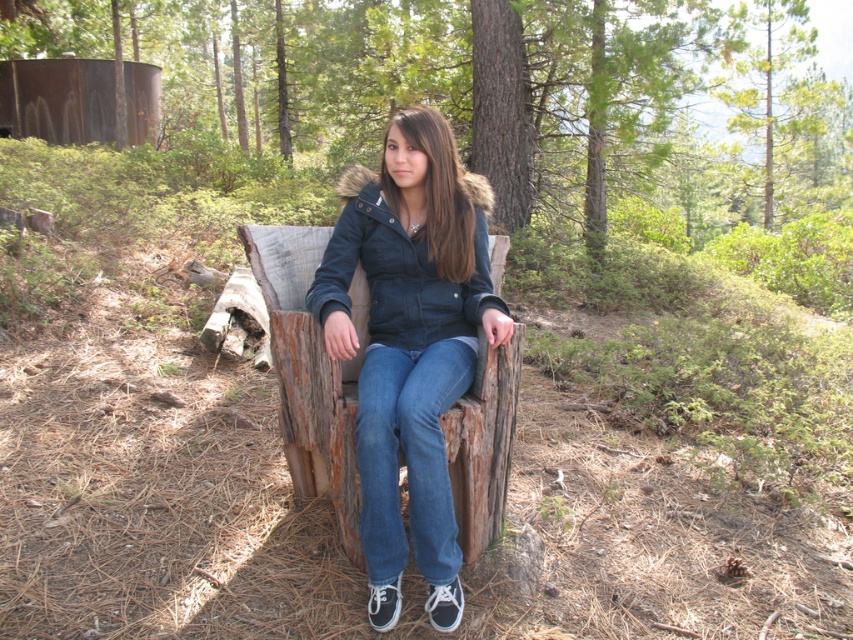
This screenshot has height=640, width=853. What do you see at coordinates (410, 346) in the screenshot? I see `denim jacket at center` at bounding box center [410, 346].

Between denim jacket at center and denim at center, which one has more height?

denim jacket at center is taller.

What do you see at coordinates (410, 346) in the screenshot?
I see `denim jacket at center` at bounding box center [410, 346].

At what (x,y) coordinates should I click in order to perform the action: click on denim jacket at center. Please return your answer as a coordinate pair (x, y). This screenshot has height=640, width=853. Looking at the image, I should click on (410, 346).